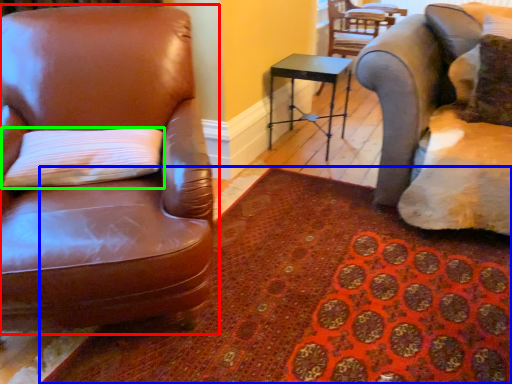
Question: Which object is positioned closest to chair (highlighted by a red box)? Select from mat (highlighted by a blue box) and pillow (highlighted by a green box).

Choices:
 (A) mat
 (B) pillow

Answer: (B)